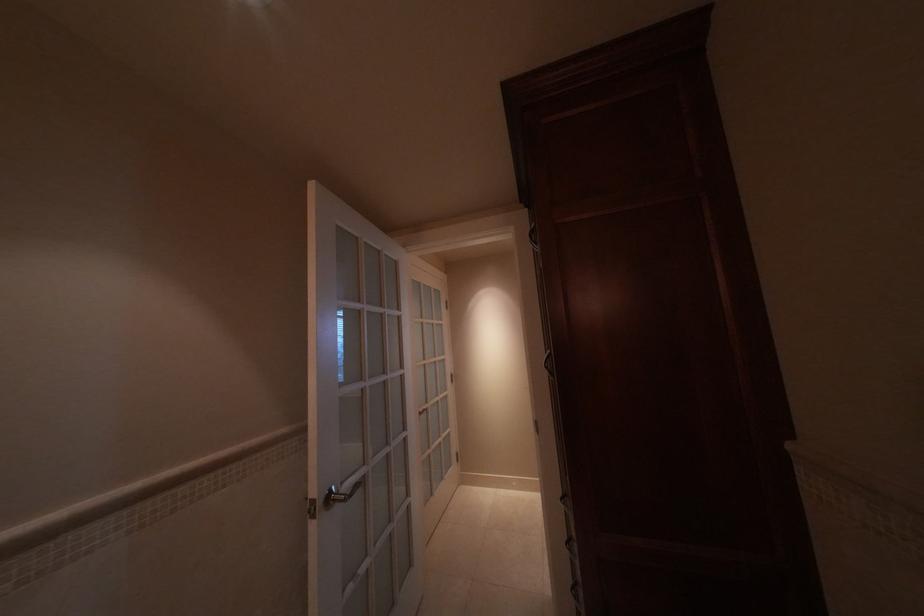
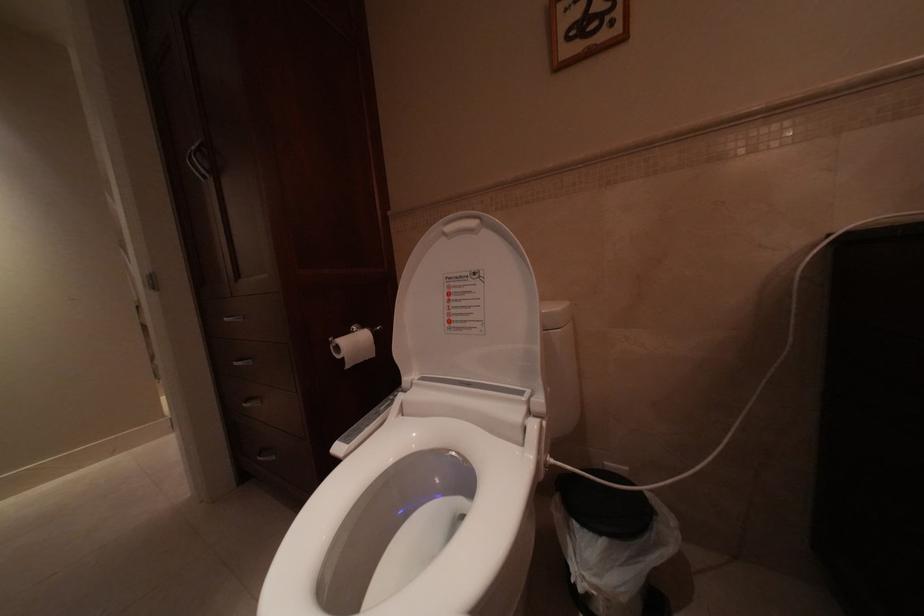
Question: Based on the continuous images, in which direction is the camera rotating? Reply with the corresponding letter.

Choices:
 (A) Left
 (B) Right
 (C) Up
 (D) Down

Answer: (B)